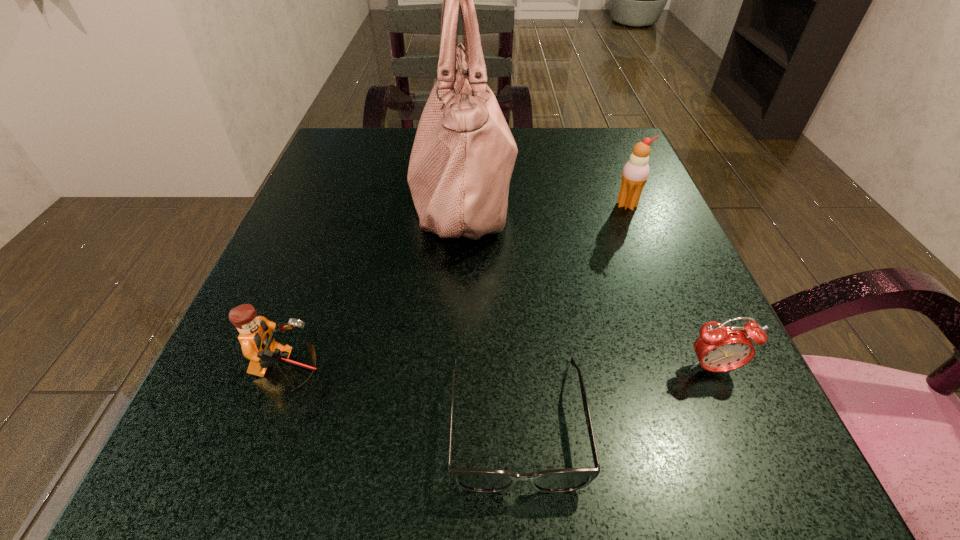
The width and height of the screenshot is (960, 540). I want to click on vacant area between the fourth shortest object and the Lego, so [458, 288].

Locate an element on the screen. This screenshot has height=540, width=960. unoccupied position between the handbag and the alarm clock is located at coordinates (588, 282).

The height and width of the screenshot is (540, 960). I want to click on free space between the leftmost object and the icecream, so click(458, 288).

Locate an element on the screen. vacant space that is in between the Lego and the handbag is located at coordinates (375, 284).

Where is `unoccupied position between the second tallest object and the sunglasses`? unoccupied position between the second tallest object and the sunglasses is located at coordinates (572, 314).

This screenshot has height=540, width=960. I want to click on vacant region between the handbag and the second tallest object, so click(544, 200).

This screenshot has width=960, height=540. I want to click on vacant point located between the alarm clock and the sunglasses, so click(x=614, y=396).

Identify the location of blank region between the handbag and the leftmost object. Image resolution: width=960 pixels, height=540 pixels. (375, 284).

Locate an element on the screen. free point between the sunglasses and the icecream is located at coordinates (572, 314).

This screenshot has width=960, height=540. I want to click on the third closest object relative to the shortest object, so click(463, 155).